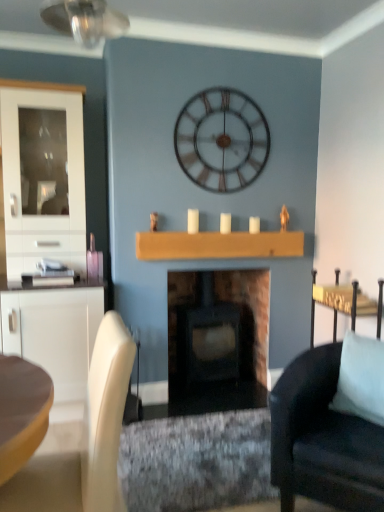
Question: From the image's perspective, is white matte candle at center, the second candle from the left, under white glossy cabinet at left?

Choices:
 (A) no
 (B) yes

Answer: (A)

Question: Can we say white matte candle at center, the second candle from the left, lies outside white glossy cabinet at left?

Choices:
 (A) yes
 (B) no

Answer: (A)

Question: Considering the relative positions of white matte candle at center, the second candle from the left, and white glossy cabinet at left in the image provided, is white matte candle at center, the second candle from the left, to the right of white glossy cabinet at left from the viewer's perspective?

Choices:
 (A) no
 (B) yes

Answer: (B)

Question: Can you confirm if white matte candle at center, positioned as the 2th candle in right-to-left order, is positioned to the left of white glossy cabinet at left?

Choices:
 (A) no
 (B) yes

Answer: (A)

Question: Is white glossy cabinet at left a part of white matte candle at center, the second candle from the left?

Choices:
 (A) no
 (B) yes

Answer: (A)

Question: In terms of height, does metallic silver clock at upper center look taller or shorter compared to light blue fabric pillow at right?

Choices:
 (A) tall
 (B) short

Answer: (A)

Question: From a real-world perspective, relative to light blue fabric pillow at right, is metallic silver clock at upper center vertically above or below?

Choices:
 (A) below
 (B) above

Answer: (B)

Question: Is metallic silver clock at upper center wider or thinner than light blue fabric pillow at right?

Choices:
 (A) wide
 (B) thin

Answer: (B)

Question: Is metallic silver clock at upper center to the left or to the right of light blue fabric pillow at right in the image?

Choices:
 (A) right
 (B) left

Answer: (B)

Question: Looking at the image, does matte black wood-burning stove at center seem bigger or smaller compared to metallic gold side table at right?

Choices:
 (A) small
 (B) big

Answer: (B)

Question: Does point (x=248, y=310) appear closer or farther from the camera than point (x=329, y=293)?

Choices:
 (A) farther
 (B) closer

Answer: (A)

Question: Would you say matte black wood-burning stove at center is to the left or to the right of metallic gold side table at right in the picture?

Choices:
 (A) right
 (B) left

Answer: (B)

Question: From their relative heights in the image, would you say matte black wood-burning stove at center is taller or shorter than metallic gold side table at right?

Choices:
 (A) tall
 (B) short

Answer: (A)

Question: Is metallic silver clock at upper center in front of or behind white glossy cabinet at left in the image?

Choices:
 (A) front
 (B) behind

Answer: (B)

Question: From the image's perspective, is metallic silver clock at upper center positioned above or below white glossy cabinet at left?

Choices:
 (A) below
 (B) above

Answer: (B)